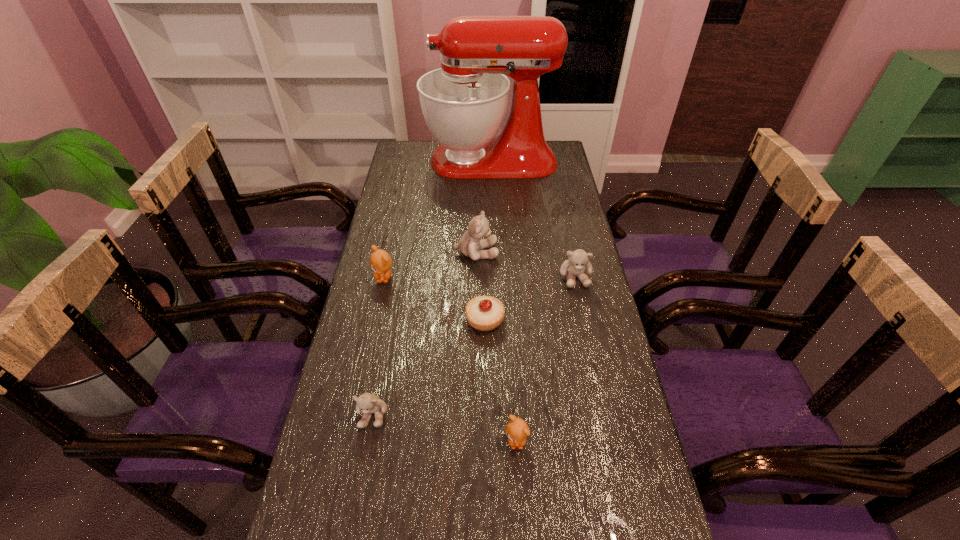
I want to click on empty space between the farthest object and the nearer brown teddy bear, so click(503, 301).

This screenshot has width=960, height=540. In order to click on free space that is in between the nearer brown teddy bear and the rightmost gray teddy bear in this screenshot , I will do `click(545, 359)`.

Where is `free space between the second biggest gray teddy bear and the nearest gray teddy bear`? The width and height of the screenshot is (960, 540). free space between the second biggest gray teddy bear and the nearest gray teddy bear is located at coordinates (474, 345).

Find the location of `unoccupied position between the leftmost gray teddy bear and the fifth farthest object`. unoccupied position between the leftmost gray teddy bear and the fifth farthest object is located at coordinates (429, 367).

Find the location of `empty space between the tallest teddy bear and the pastry`. empty space between the tallest teddy bear and the pastry is located at coordinates (480, 286).

Where is `vacant area that lies between the rightmost gray teddy bear and the smallest gray teddy bear`? The image size is (960, 540). vacant area that lies between the rightmost gray teddy bear and the smallest gray teddy bear is located at coordinates (474, 345).

Identify the location of vacant space in between the farther brown teddy bear and the farthest object. (438, 219).

The height and width of the screenshot is (540, 960). I want to click on free space that is in between the second gray teddy bear from left to right and the farther brown teddy bear, so click(x=430, y=265).

Identify which object is the fifth closest to the smallest gray teddy bear. Please provide its 2D coordinates. Your answer should be formatted as a tuple, i.e. [(x, y)], where the tuple contains the x and y coordinates of a point satisfying the conditions above.

[(578, 262)]

What are the coordinates of `object that ranks as the closest to the smallest gray teddy bear` in the screenshot? It's located at (484, 313).